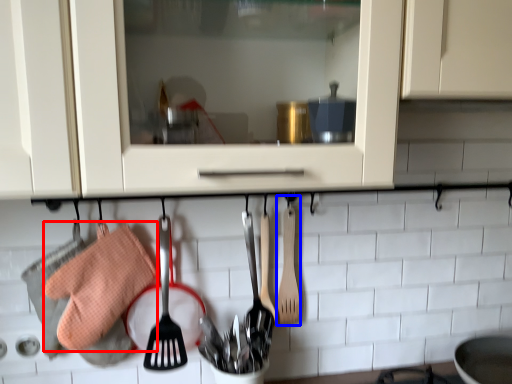
Question: Which point is closer to the camera, material (highlighted by a red box) or spatula (highlighted by a blue box)?

Choices:
 (A) material
 (B) spatula

Answer: (A)